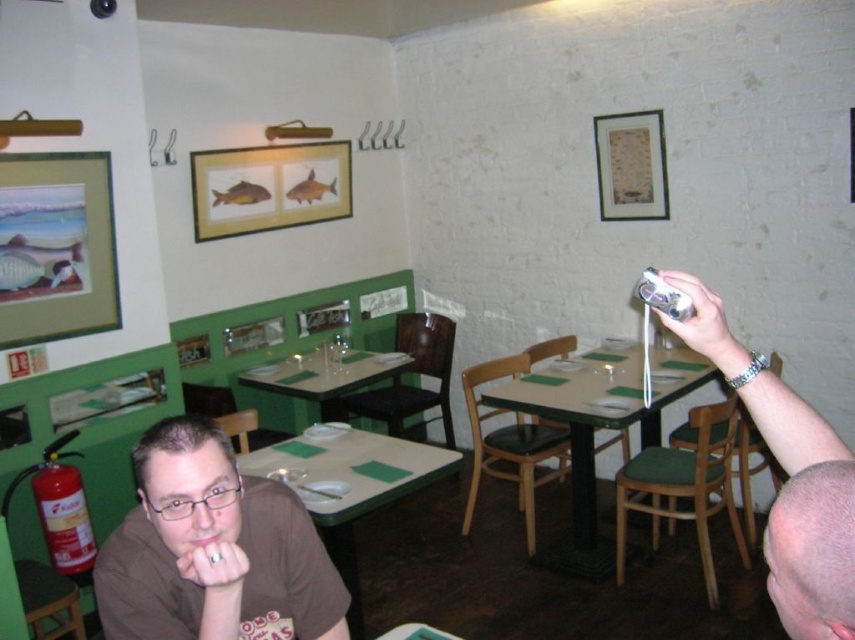
Question: Is silver metallic camera at upper right below wooden framed picture at upper center?

Choices:
 (A) no
 (B) yes

Answer: (B)

Question: Which point is farther from the camera taking this photo?

Choices:
 (A) (337, 396)
 (B) (305, 193)

Answer: (B)

Question: Based on their relative distances, which object is nearer to the green matte table at center?

Choices:
 (A) wooden framed picture at upper center
 (B) green wood table at center

Answer: (B)

Question: Is green matte table at center to the left of wooden framed paper at upper right from the viewer's perspective?

Choices:
 (A) yes
 (B) no

Answer: (A)

Question: Does matte wooden picture frame at upper left appear on the right side of green matte table at center?

Choices:
 (A) no
 (B) yes

Answer: (A)

Question: Which point is farther to the camera?

Choices:
 (A) (777, 586)
 (B) (629, 128)
 (C) (262, 552)
 (D) (623, 358)

Answer: (B)